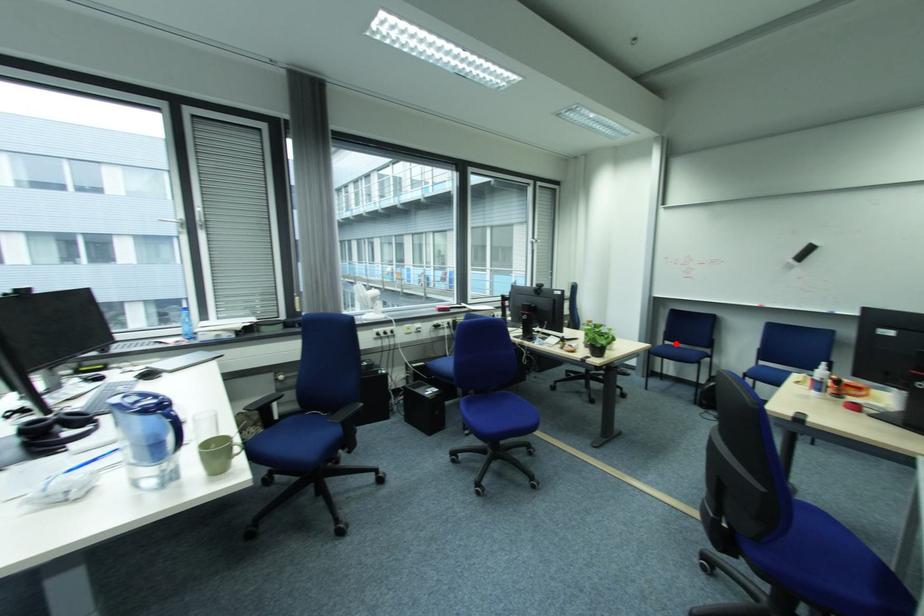
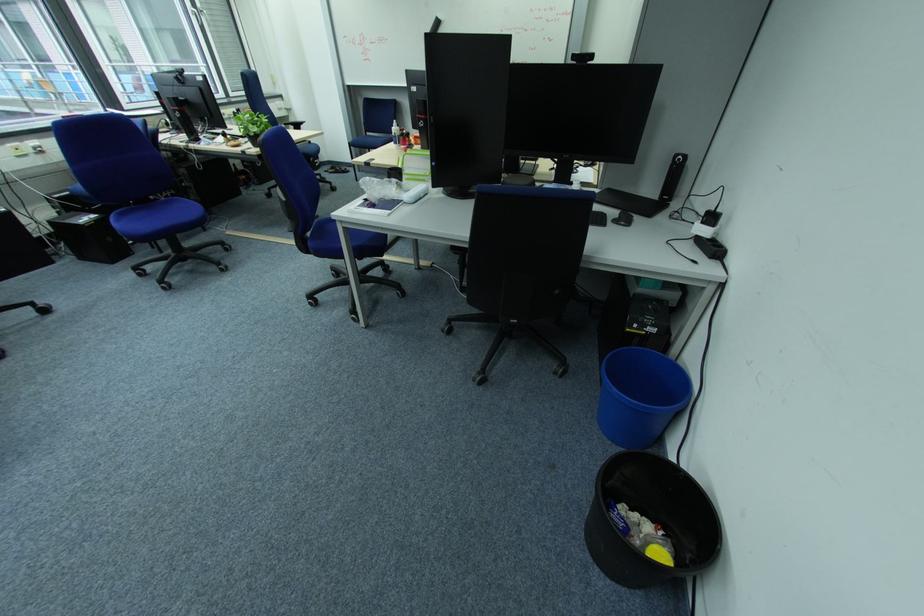
Find the pixel in the second image that matches the highlighted location in the first image.

(378, 135)